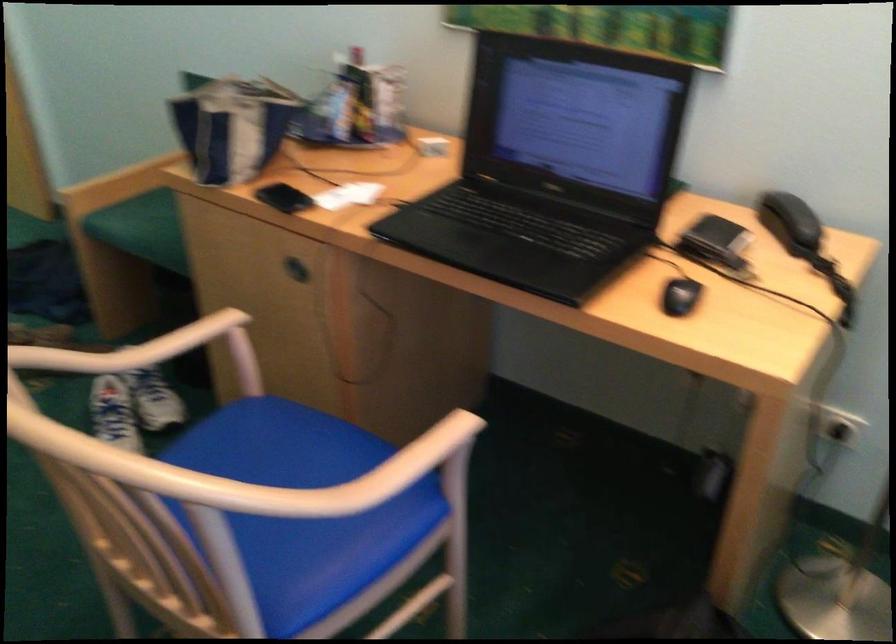
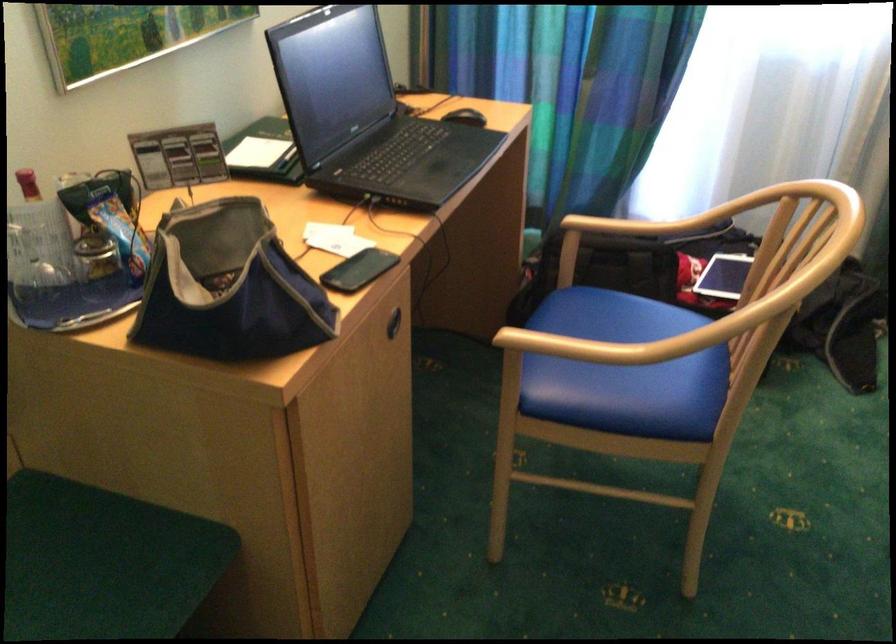
Where in the second image is the point corresponding to [395,477] from the first image?

(647, 231)